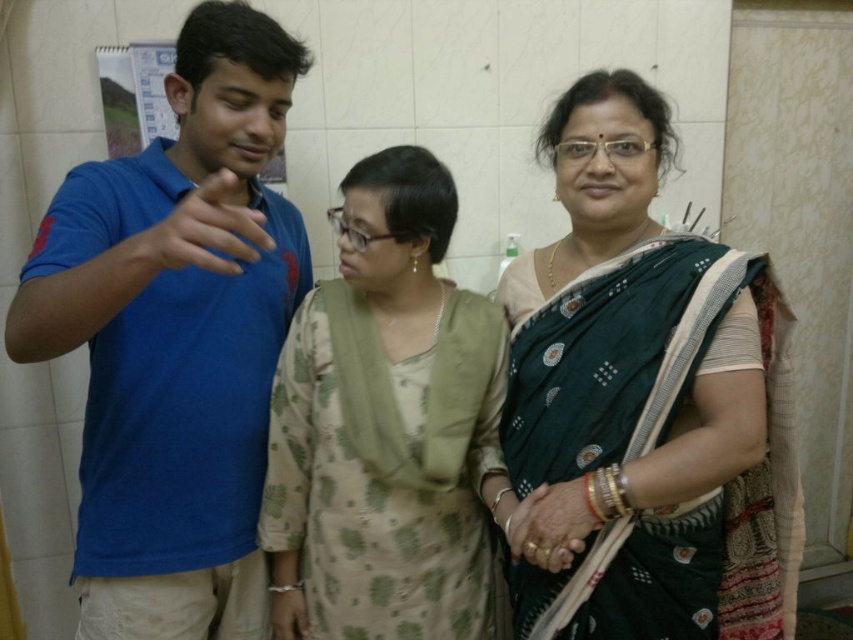
Question: Which point appears closest to the camera in this image?

Choices:
 (A) (212, 154)
 (B) (596, 257)
 (C) (495, 353)

Answer: (A)

Question: Which object is closer to the camera taking this photo?

Choices:
 (A) beige floral dress at center
 (B) blue cotton shirt at left
 (C) green silk saree at center

Answer: (B)

Question: Does green silk saree at center have a larger size compared to beige floral dress at center?

Choices:
 (A) no
 (B) yes

Answer: (B)

Question: Among these objects, which one is nearest to the camera?

Choices:
 (A) beige floral dress at center
 (B) green silk saree at center

Answer: (A)

Question: Is blue cotton shirt at left to the right of beige floral dress at center from the viewer's perspective?

Choices:
 (A) no
 (B) yes

Answer: (A)

Question: Does blue cotton shirt at left come in front of beige floral dress at center?

Choices:
 (A) no
 (B) yes

Answer: (B)